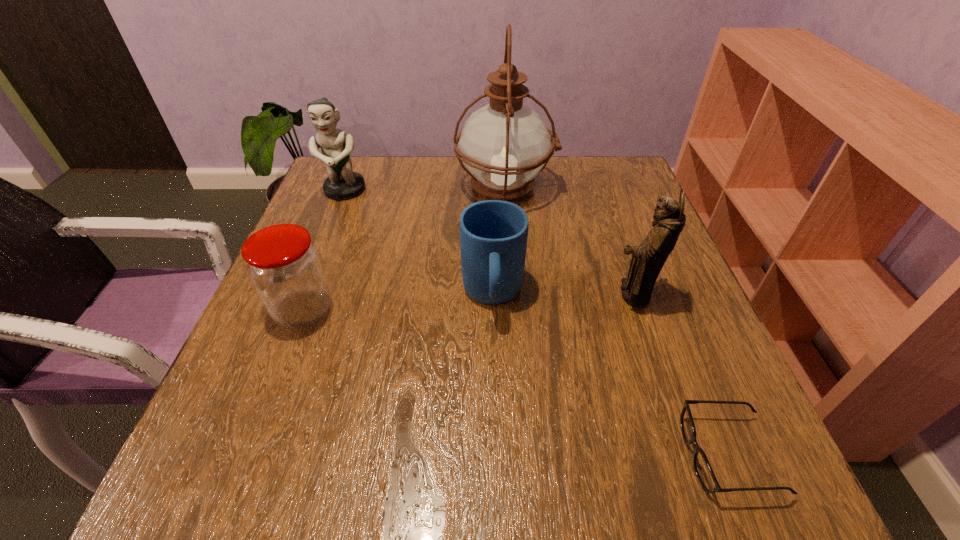
At what (x,y) coordinates should I click in order to perform the action: click on figurine located in the left edge section of the desktop. Please return your answer as a coordinate pair (x, y). This screenshot has width=960, height=540. Looking at the image, I should click on (342, 184).

You are a GUI agent. You are given a task and a screenshot of the screen. Output one action in this format:
    pyautogui.click(x=<x>, y=<y>)
    Task: Click on the jar situated at the left edge
    Image resolution: width=960 pixels, height=540 pixels.
    Given the screenshot: What is the action you would take?
    pos(284,266)

The width and height of the screenshot is (960, 540). I want to click on figurine present at the right edge, so click(x=648, y=259).

Find the location of a particular element. This screenshot has height=540, width=960. spectacles that is positioned at the right edge is located at coordinates (702, 468).

Where is `object that is positioned at the far left corner`? Image resolution: width=960 pixels, height=540 pixels. object that is positioned at the far left corner is located at coordinates (342, 184).

Find the location of a particular element. The height and width of the screenshot is (540, 960). object present at the near right corner is located at coordinates (702, 468).

Where is `free region at the far edge`? Image resolution: width=960 pixels, height=540 pixels. free region at the far edge is located at coordinates (548, 190).

Find the location of a particular element. vacant space at the near edge is located at coordinates (423, 485).

The width and height of the screenshot is (960, 540). Find the location of `free space at the left edge`. free space at the left edge is located at coordinates (348, 272).

Identify the location of vacant space at the right edge. (669, 317).